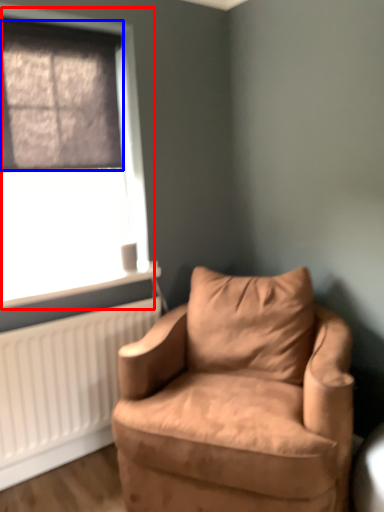
Question: Which object appears closest to the camera in this image, window (highlighted by a red box) or window screen (highlighted by a blue box)?

Choices:
 (A) window
 (B) window screen

Answer: (B)